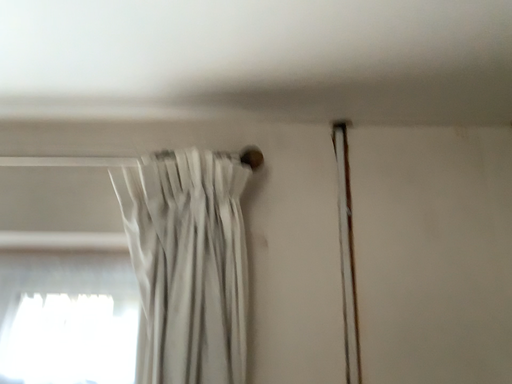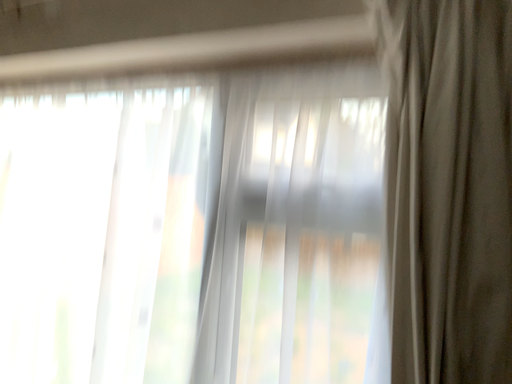
Question: How did the camera likely rotate when shooting the video?

Choices:
 (A) rotated upward
 (B) rotated downward

Answer: (B)